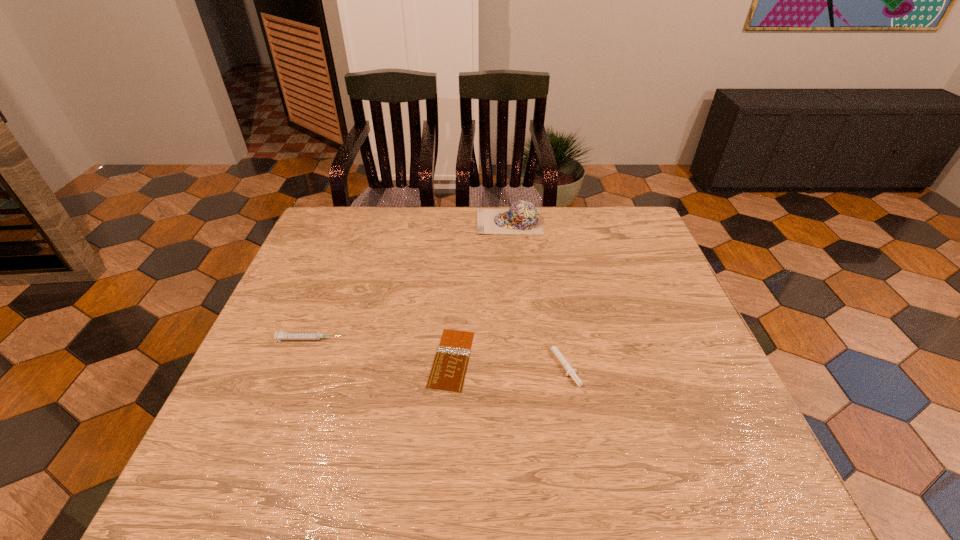
The height and width of the screenshot is (540, 960). Find the location of `free space at the far right corner of the desktop`. free space at the far right corner of the desktop is located at coordinates (636, 209).

What are the coordinates of `vacant space at the near right corner of the desktop` in the screenshot? It's located at (755, 465).

At what (x,y) coordinates should I click in order to perform the action: click on empty space between the leftmost object and the second shortest object. Please return your answer as a coordinate pair (x, y). Image resolution: width=960 pixels, height=540 pixels. Looking at the image, I should click on (436, 350).

Image resolution: width=960 pixels, height=540 pixels. What are the coordinates of `free point between the second shortest object and the shortest object` in the screenshot? It's located at (x=507, y=361).

I want to click on unoccupied position between the chocolate bar and the second shortest object, so click(507, 361).

This screenshot has height=540, width=960. In order to click on vacant area between the left syringe and the tallest object in this screenshot , I will do `click(410, 280)`.

Find the location of a particular element. This screenshot has width=960, height=540. free point between the right syringe and the shortest object is located at coordinates (507, 361).

Find the location of `vacant space in between the third object from right to left and the second tallest object`. vacant space in between the third object from right to left and the second tallest object is located at coordinates (381, 349).

At what (x,y) coordinates should I click in order to perform the action: click on free space between the tallest object and the second shortest object. Please return your answer as a coordinate pair (x, y). This screenshot has width=960, height=540. Looking at the image, I should click on (536, 292).

Identify the location of unoccupied area between the cap and the taller syringe. (410, 280).